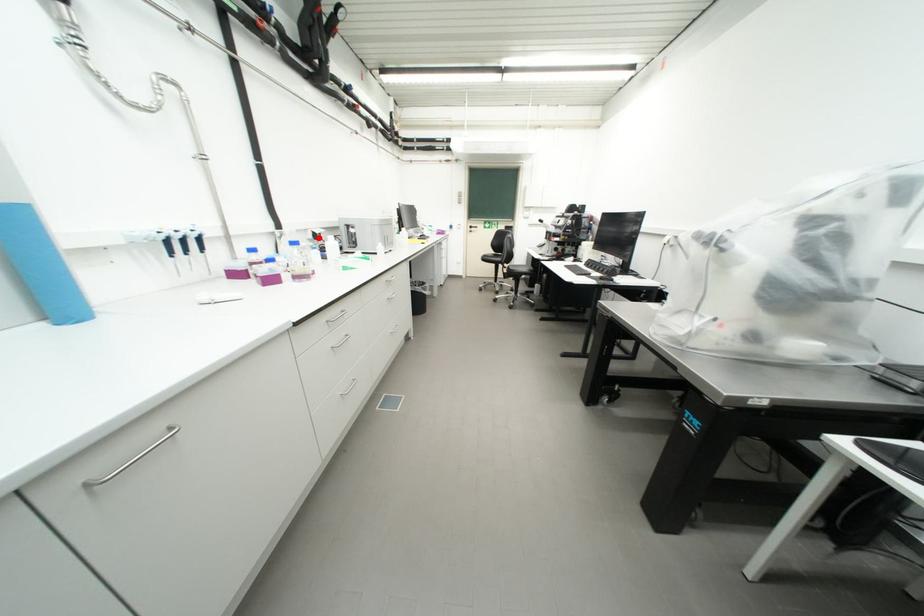
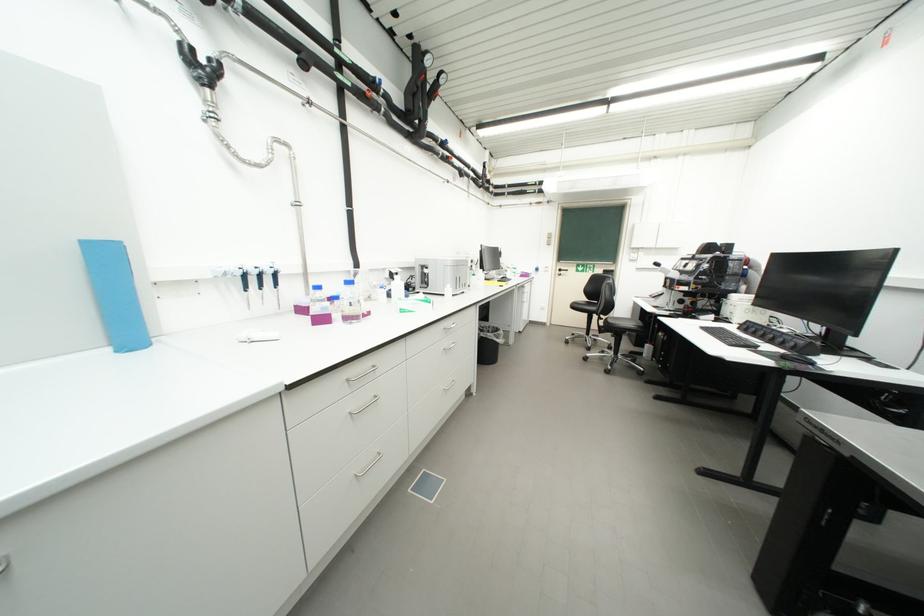
In the second image, find the point that corresponds to the highlighted location in the first image.

(395, 277)